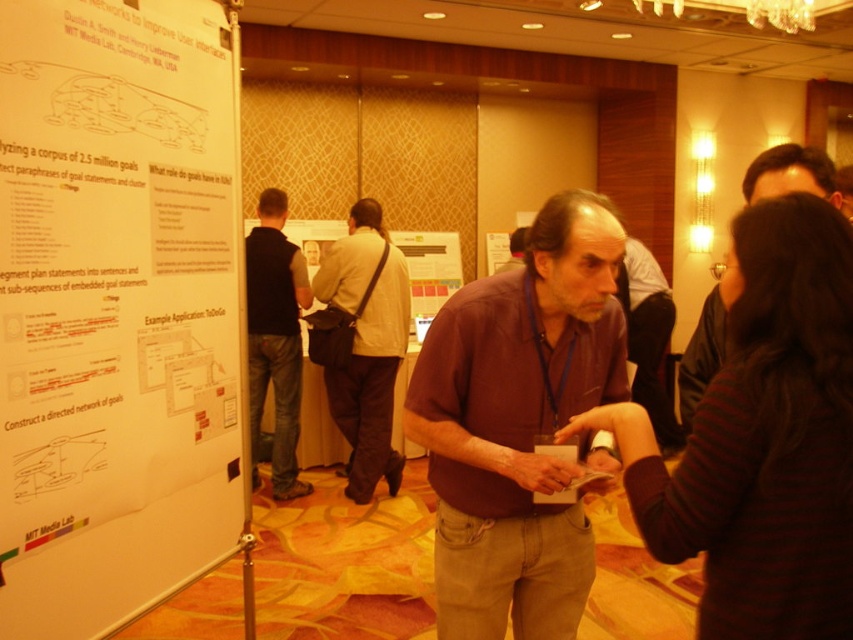
Consider the image. Who is positioned more to the left, striped sweater at center or maroon cotton shirt at center?

From the viewer's perspective, maroon cotton shirt at center appears more on the left side.

Is point (804, 436) positioned in front of point (508, 616)?

Yes, it is.

Locate an element on the screen. striped sweater at center is located at coordinates (762, 438).

Does striped sweater at center have a smaller size compared to light brown leather jacket at center?

Yes, striped sweater at center is smaller than light brown leather jacket at center.

This screenshot has width=853, height=640. What do you see at coordinates (762, 438) in the screenshot? I see `striped sweater at center` at bounding box center [762, 438].

This screenshot has height=640, width=853. I want to click on striped sweater at center, so click(x=762, y=438).

Looking at this image, does light brown leather jacket at center have a lesser width compared to dark gray vest at center?

Incorrect, light brown leather jacket at center's width is not less than dark gray vest at center's.

How much distance is there between light brown leather jacket at center and dark gray vest at center?

They are 14.67 inches apart.

Find the location of a particular element. light brown leather jacket at center is located at coordinates (366, 346).